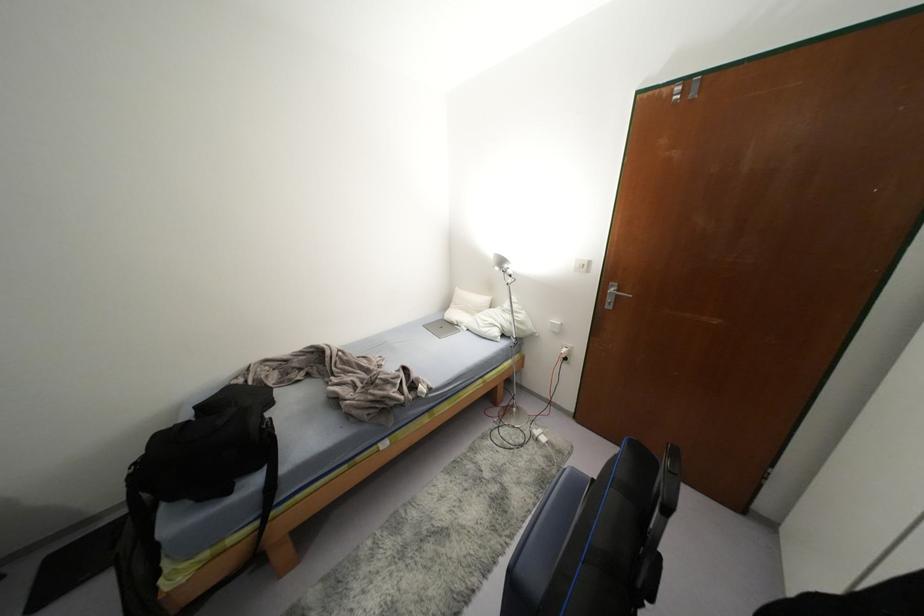
Where would you pull the silver door handle? Please return your answer as a coordinate pair (x, y).

(614, 294)